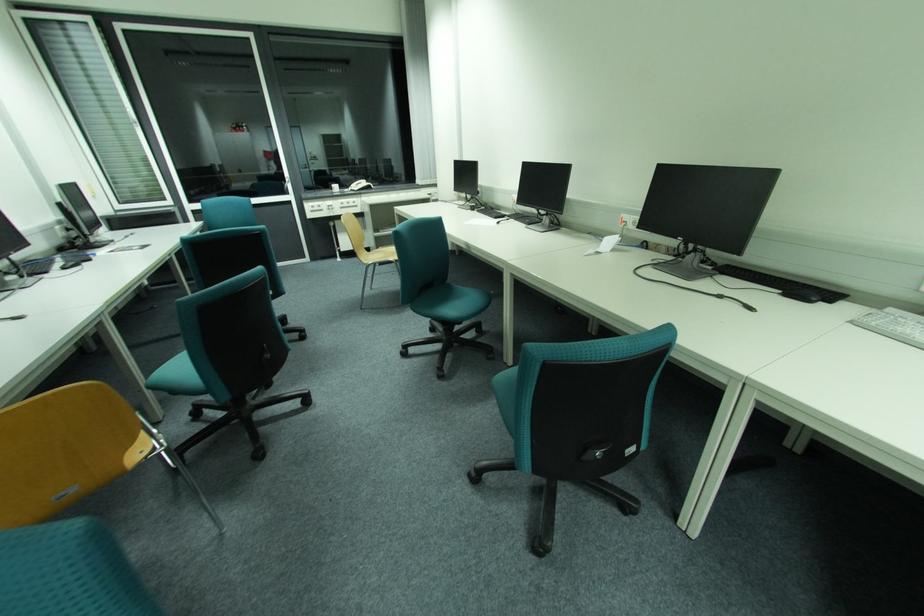
This screenshot has height=616, width=924. What do you see at coordinates (358, 184) in the screenshot?
I see `the white telephone handset` at bounding box center [358, 184].